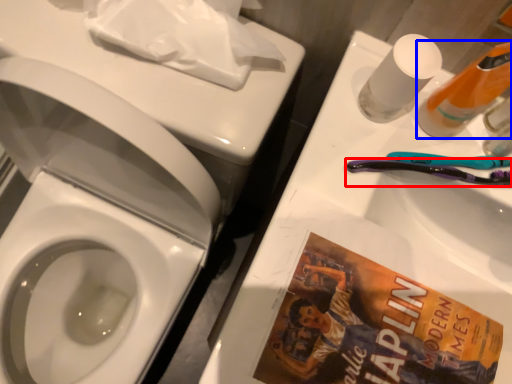
Question: Which object is closer to the camera taking this photo, toothbrush (highlighted by a red box) or cleaning product (highlighted by a blue box)?

Choices:
 (A) toothbrush
 (B) cleaning product

Answer: (B)